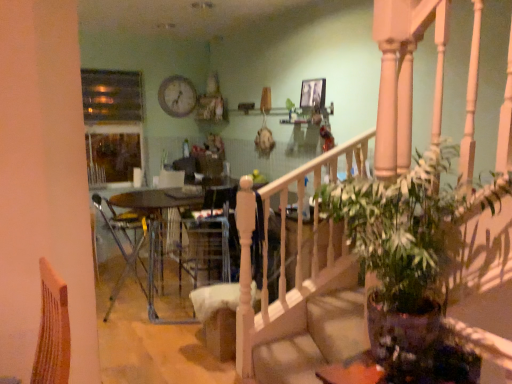
Describe the element at coordinates (415, 266) in the screenshot. I see `green glossy houseplant at lower right` at that location.

Identify the location of wooden clock at upper center. The width and height of the screenshot is (512, 384). (177, 96).

Identify the location of velvet beige armchair at center. The height and width of the screenshot is (384, 512). coord(210,238).

You are a GUI agent. You are given a task and a screenshot of the screen. Output one action in this format:
    pyautogui.click(x=<x>, y=<y>)
    Task: Click on the metallic silver chair at center
    This screenshot has width=512, height=384.
    Given the screenshot: What is the action you would take?
    pyautogui.click(x=128, y=242)

Identify the location of green glossy houseplant at lower right. (415, 266).

Is green glossy houseplant at lower right directly adjacent to wooden clock at upper center?

green glossy houseplant at lower right and wooden clock at upper center are clearly separated.

What's the angular difference between green glossy houseplant at lower right and wooden clock at upper center's facing directions?

The facing directions of green glossy houseplant at lower right and wooden clock at upper center are 90.7 degrees apart.

In order to click on clock above the green glossy houseplant at lower right (from the image's perspective) in this screenshot , I will do `click(177, 96)`.

Can you confirm if green glossy houseplant at lower right is shorter than wooden clock at upper center?

In fact, green glossy houseplant at lower right may be taller than wooden clock at upper center.

Could you tell me if velvet beige armchair at center is turned towards wooden clock at upper center?

No, velvet beige armchair at center is not aimed at wooden clock at upper center.

Is velvet beige armchair at center surrounding wooden clock at upper center?

No, wooden clock at upper center is not a part of velvet beige armchair at center.

From a real-world perspective, which is physically below, velvet beige armchair at center or wooden clock at upper center?

velvet beige armchair at center.

From the picture: Is velvet beige armchair at center far from wooden clock at upper center?

Yes, velvet beige armchair at center and wooden clock at upper center are quite far apart.

From the picture: Is wooden clock at upper center wider or thinner than green glossy houseplant at lower right?

wooden clock at upper center is thinner than green glossy houseplant at lower right.

Can you confirm if wooden clock at upper center is bigger than green glossy houseplant at lower right?

Actually, wooden clock at upper center might be smaller than green glossy houseplant at lower right.

Consider the image. Can you confirm if wooden clock at upper center is shorter than green glossy houseplant at lower right?

Yes, wooden clock at upper center is shorter than green glossy houseplant at lower right.

From a real-world perspective, which object rests below the other?

green glossy houseplant at lower right.

From their relative heights in the image, would you say velvet beige armchair at center is taller or shorter than metallic silver chair at center?

velvet beige armchair at center is taller than metallic silver chair at center.

Are velvet beige armchair at center and metallic silver chair at center far apart?

velvet beige armchair at center is near metallic silver chair at center, not far away.

From a real-world perspective, is velvet beige armchair at center located beneath metallic silver chair at center?

No.

Which object is closer to the camera taking this photo, wooden clock at upper center or velvet beige armchair at center?

velvet beige armchair at center is closer to the camera.

Could you tell me if wooden clock at upper center is facing velvet beige armchair at center?

No, wooden clock at upper center is not facing towards velvet beige armchair at center.

From the image's perspective, between wooden clock at upper center and velvet beige armchair at center, who is located below?

velvet beige armchair at center, from the image's perspective.

Considering the relative sizes of wooden clock at upper center and metallic silver chair at center in the image provided, is wooden clock at upper center taller than metallic silver chair at center?

No.

Is wooden clock at upper center turned away from metallic silver chair at center?

wooden clock at upper center does not have its back to metallic silver chair at center.

How far apart are wooden clock at upper center and metallic silver chair at center?

wooden clock at upper center is 1.65 meters away from metallic silver chair at center.

Is the depth of wooden clock at upper center greater than that of metallic silver chair at center?

Yes, wooden clock at upper center is behind metallic silver chair at center.

Is metallic silver chair at center facing towards green glossy houseplant at lower right?

No, metallic silver chair at center is not aimed at green glossy houseplant at lower right.

Between metallic silver chair at center and green glossy houseplant at lower right, which one has larger size?

With larger size is green glossy houseplant at lower right.

Considering the relative positions of metallic silver chair at center and green glossy houseplant at lower right in the image provided, is metallic silver chair at center to the left or to the right of green glossy houseplant at lower right?

In the image, metallic silver chair at center appears on the left side of green glossy houseplant at lower right.

Is metallic silver chair at center in front of green glossy houseplant at lower right?

No.

What are the coordinates of `clock behind the green glossy houseplant at lower right` in the screenshot? It's located at (177, 96).

The width and height of the screenshot is (512, 384). Find the location of `armchair lying in front of the wooden clock at upper center`. armchair lying in front of the wooden clock at upper center is located at coordinates (210, 238).

From the image, which object appears to be farther from green glossy houseplant at lower right, wooden clock at upper center or velvet beige armchair at center?

Based on the image, wooden clock at upper center appears to be further to green glossy houseplant at lower right.

From the image, which object appears to be farther from velvet beige armchair at center, green glossy houseplant at lower right or wooden clock at upper center?

Answer: green glossy houseplant at lower right.

Estimate the real-world distances between objects in this image. Which object is closer to metallic silver chair at center, wooden clock at upper center or velvet beige armchair at center?

velvet beige armchair at center.

From the image, which object appears to be farther from wooden clock at upper center, velvet beige armchair at center or metallic silver chair at center?

Based on the image, velvet beige armchair at center appears to be further to wooden clock at upper center.

Based on their spatial positions, is wooden clock at upper center or green glossy houseplant at lower right further from velvet beige armchair at center?

Based on the image, green glossy houseplant at lower right appears to be further to velvet beige armchair at center.

Looking at the image, which one is located closer to wooden clock at upper center, metallic silver chair at center or green glossy houseplant at lower right?

The object closer to wooden clock at upper center is metallic silver chair at center.

Based on their spatial positions, is metallic silver chair at center or wooden clock at upper center closer to green glossy houseplant at lower right?

Among the two, metallic silver chair at center is located nearer to green glossy houseplant at lower right.

Looking at the image, which one is located closer to metallic silver chair at center, green glossy houseplant at lower right or wooden clock at upper center?

Based on the image, wooden clock at upper center appears to be nearer to metallic silver chair at center.

Locate an element on the screen. Image resolution: width=512 pixels, height=384 pixels. chair between green glossy houseplant at lower right and velvet beige armchair at center from front to back is located at coordinates (128, 242).

Locate an element on the screen. The height and width of the screenshot is (384, 512). armchair between metallic silver chair at center and wooden clock at upper center in the front-back direction is located at coordinates (210, 238).

This screenshot has height=384, width=512. Identify the location of chair between green glossy houseplant at lower right and wooden clock at upper center in the front-back direction. (128, 242).

Where is `armchair between green glossy houseplant at lower right and wooden clock at upper center from front to back`? This screenshot has width=512, height=384. armchair between green glossy houseplant at lower right and wooden clock at upper center from front to back is located at coordinates (210, 238).